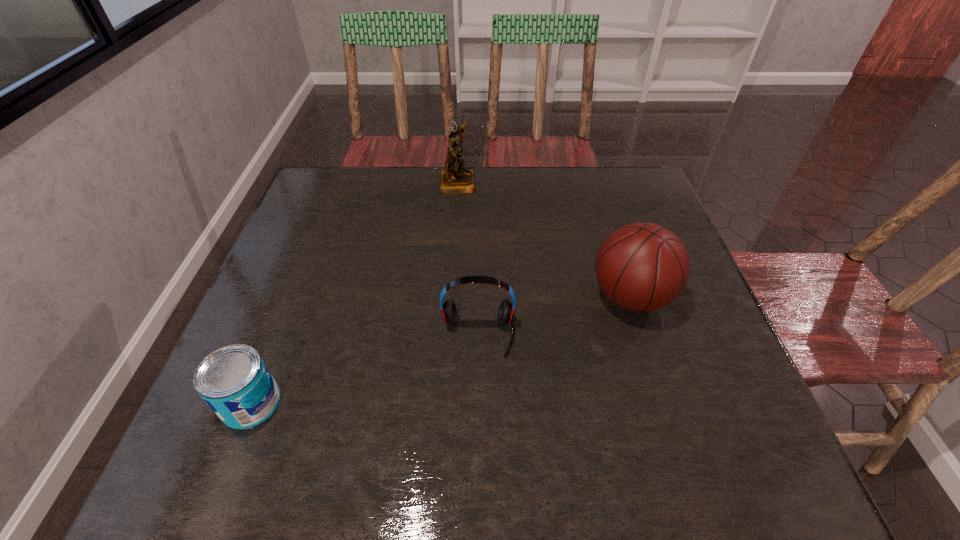
Identify the location of free spot between the third tallest object and the figurine. (468, 258).

The width and height of the screenshot is (960, 540). I want to click on vacant space that's between the second shortest object and the figurine, so click(x=468, y=258).

The image size is (960, 540). In order to click on free space between the basketball and the can in this screenshot , I will do `click(441, 349)`.

In order to click on vacant point located between the headset and the shortest object in this screenshot , I will do `click(365, 369)`.

The width and height of the screenshot is (960, 540). What are the coordinates of `free space between the leftmost object and the basketball` in the screenshot? It's located at (441, 349).

Where is `vacant area between the leftmost object and the basketball`? The image size is (960, 540). vacant area between the leftmost object and the basketball is located at coordinates (441, 349).

You are a GUI agent. You are given a task and a screenshot of the screen. Output one action in this format:
    pyautogui.click(x=<x>, y=<y>)
    Task: Click on the free space between the farthest object and the rightmost object
    This screenshot has width=960, height=540.
    Given the screenshot: What is the action you would take?
    pyautogui.click(x=544, y=239)

Point out which object is positioned as the third nearest to the rightmost object. Please provide its 2D coordinates. Your answer should be formatted as a tuple, i.e. [(x, y)], where the tuple contains the x and y coordinates of a point satisfying the conditions above.

[(234, 381)]

Identify which object is located as the nearest to the basketball. Please provide its 2D coordinates. Your answer should be formatted as a tuple, i.e. [(x, y)], where the tuple contains the x and y coordinates of a point satisfying the conditions above.

[(506, 310)]

The width and height of the screenshot is (960, 540). Find the location of `free spot that satisfies the following two spatial constraints: 1. on the back side of the basketball; 2. on the front-facing side of the figurine`. free spot that satisfies the following two spatial constraints: 1. on the back side of the basketball; 2. on the front-facing side of the figurine is located at coordinates (594, 182).